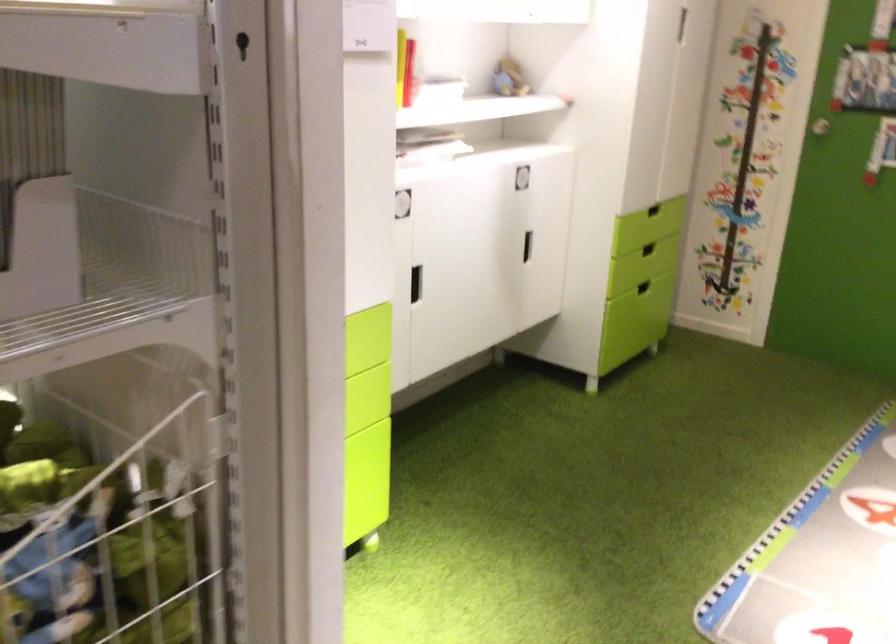
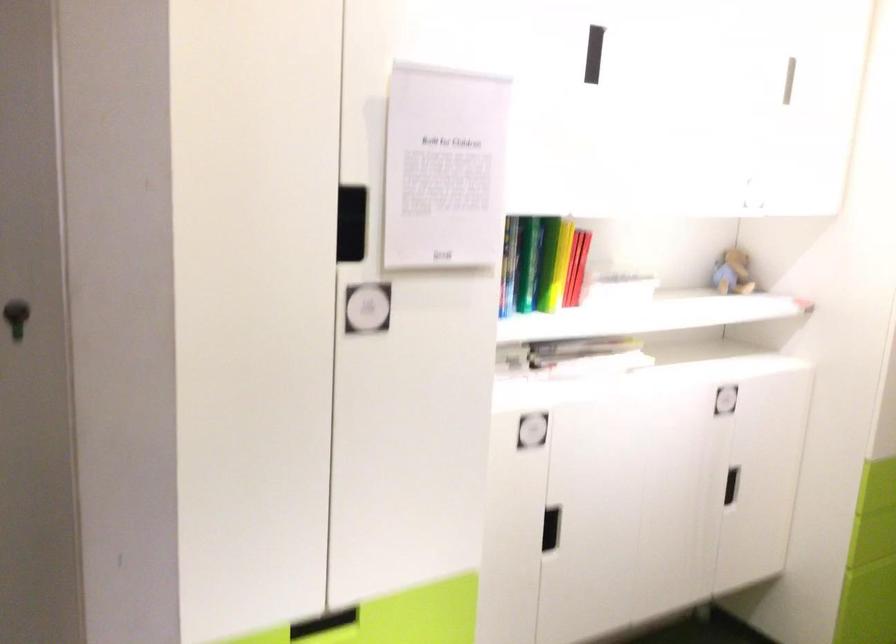
In a continuous first-person perspective shot, in which direction is the camera moving?

The cameraman walked toward right, forward.